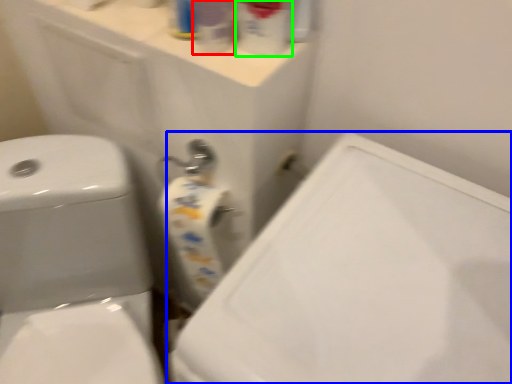
Question: Which is nearer to the cleaning product (highlighted by a red box)? porcelain (highlighted by a blue box) or cleaning product (highlighted by a green box).

Choices:
 (A) porcelain
 (B) cleaning product

Answer: (B)